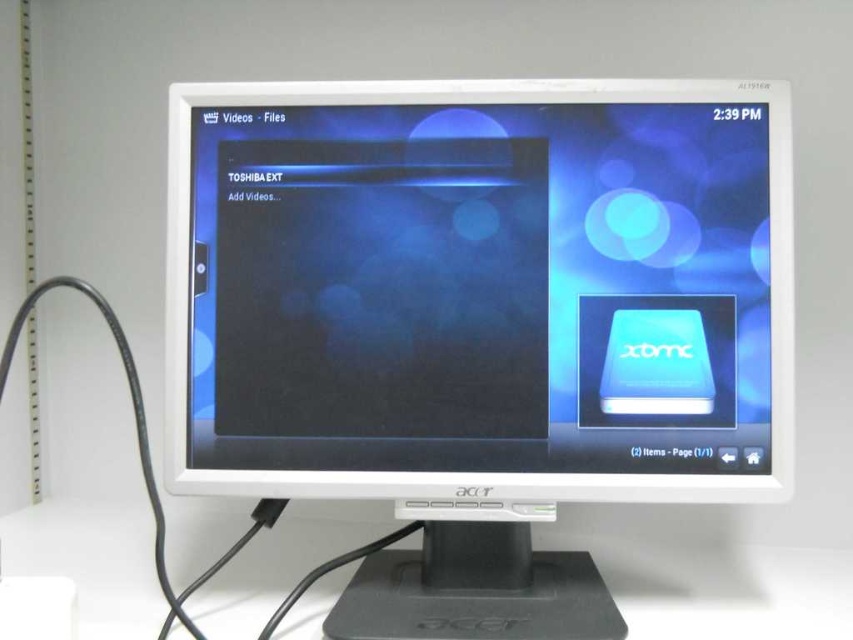
You are setting up a new monitor on your desk. The white plastic monitor at center needs to be placed on the white plastic computer desk at center. Can you fit it without overlapping the edges?

The distance between the white plastic monitor at center and white plastic computer desk at center is 9.92 inches, but since the desk is larger than the monitor, it should fit without overlapping the edges.

You are setting up a new computer desk and want to place the white plastic monitor at center on top of the white plastic computer desk at center. Based on their sizes, will the monitor fit on the desk without overhanging the edges?

The white plastic monitor at center has a greater height compared to the white plastic computer desk at center, so the monitor will not fit on the desk without overhanging the edges because it is taller than the desk.